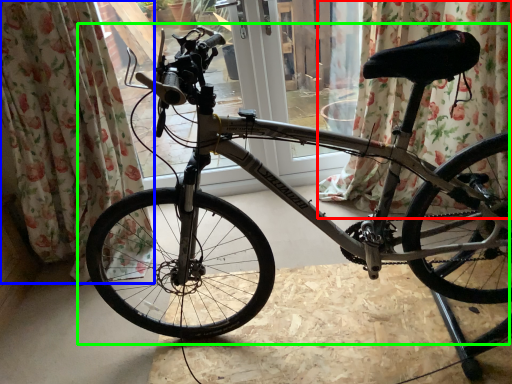
Question: Which object is positioned farthest from curtain (highlighted by a red box)? Select from curtain (highlighted by a blue box) and bicycle (highlighted by a green box).

Choices:
 (A) curtain
 (B) bicycle

Answer: (A)